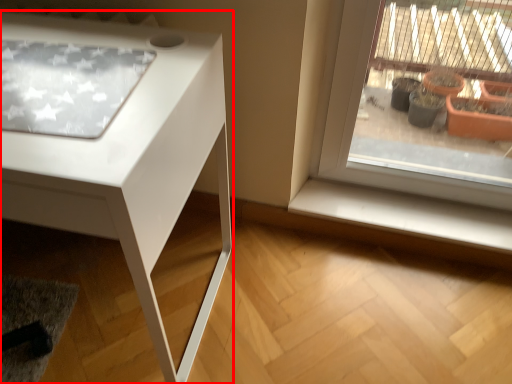
Question: Considering the relative positions of table (annotated by the red box) and window sill in the image provided, where is table (annotated by the red box) located with respect to the staircase?

Choices:
 (A) right
 (B) left

Answer: (B)